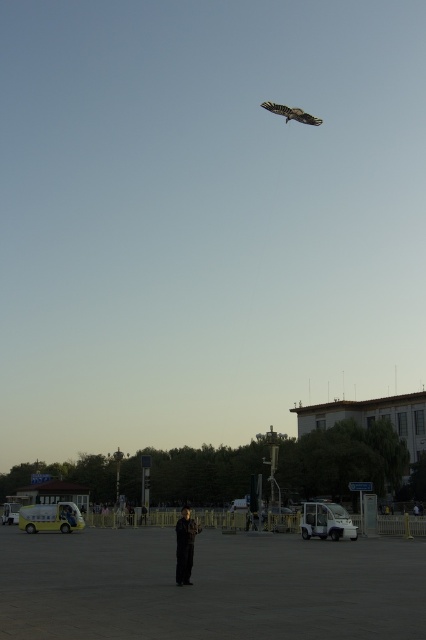
Question: Can you confirm if dark gray suit at center is positioned to the right of brown wooden kite at upper center?

Choices:
 (A) yes
 (B) no

Answer: (B)

Question: Is dark gray suit at center bigger than brown wooden kite at upper center?

Choices:
 (A) no
 (B) yes

Answer: (B)

Question: Which point is closer to the camera?

Choices:
 (A) (310, 124)
 (B) (184, 508)

Answer: (B)

Question: Does dark gray suit at center appear on the left side of brown wooden kite at upper center?

Choices:
 (A) yes
 (B) no

Answer: (A)